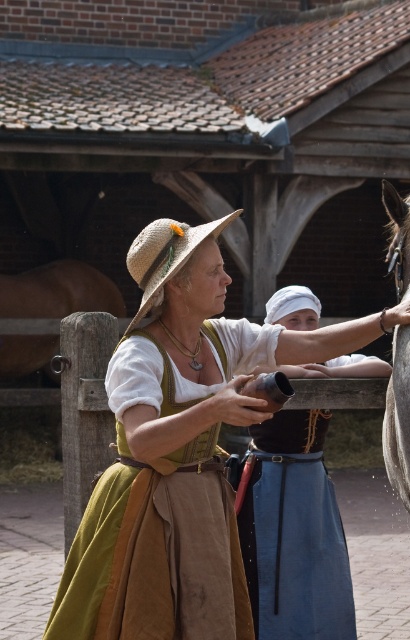
Question: Does matte straw hat at center come behind straw hat at center?

Choices:
 (A) no
 (B) yes

Answer: (A)

Question: Which of the following is the closest to the observer?

Choices:
 (A) (403, 416)
 (B) (147, 241)

Answer: (B)

Question: Where is matte brown leather purse at center located in relation to straw hat at center in the image?

Choices:
 (A) above
 (B) below

Answer: (B)

Question: Can you confirm if matte brown leather purse at center is positioned to the right of straw hat at center?

Choices:
 (A) no
 (B) yes

Answer: (B)

Question: Which object appears farthest from the camera in this image?

Choices:
 (A) brown leather horse at right
 (B) matte brown leather purse at center
 (C) straw hat at center
 (D) matte straw hat at center

Answer: (B)

Question: Which point appears farthest from the camera in this image?

Choices:
 (A) click(x=401, y=500)
 (B) click(x=321, y=436)
 (C) click(x=109, y=524)

Answer: (A)